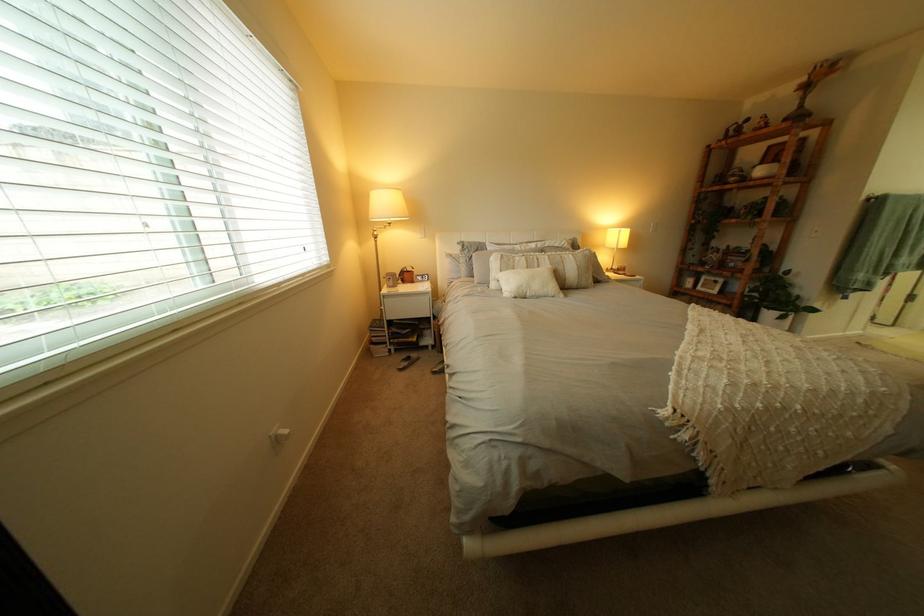
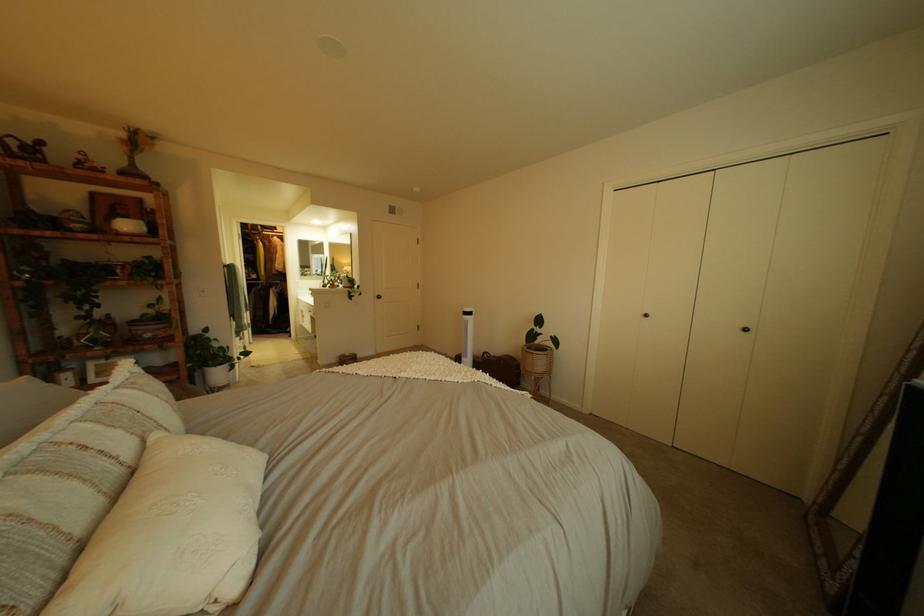
Find the pixel in the second image that matches point 565,268 in the first image.

(172, 436)